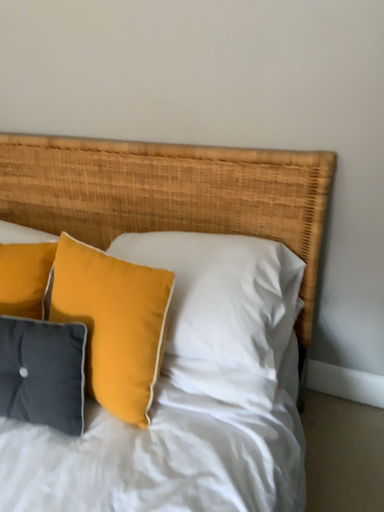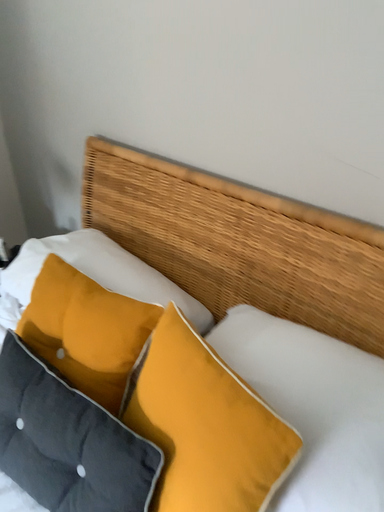
Question: Which way did the camera rotate in the video?

Choices:
 (A) rotated right
 (B) rotated left

Answer: (B)